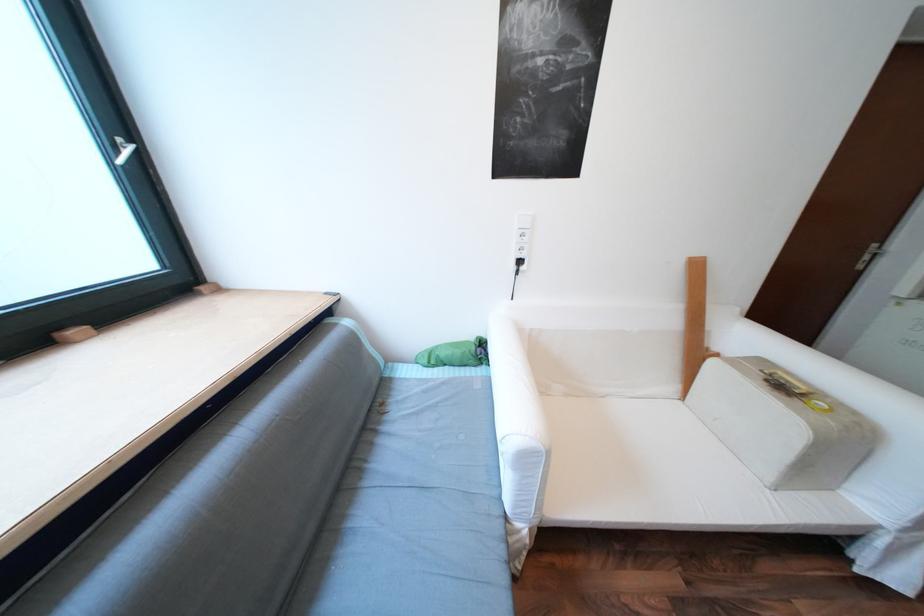
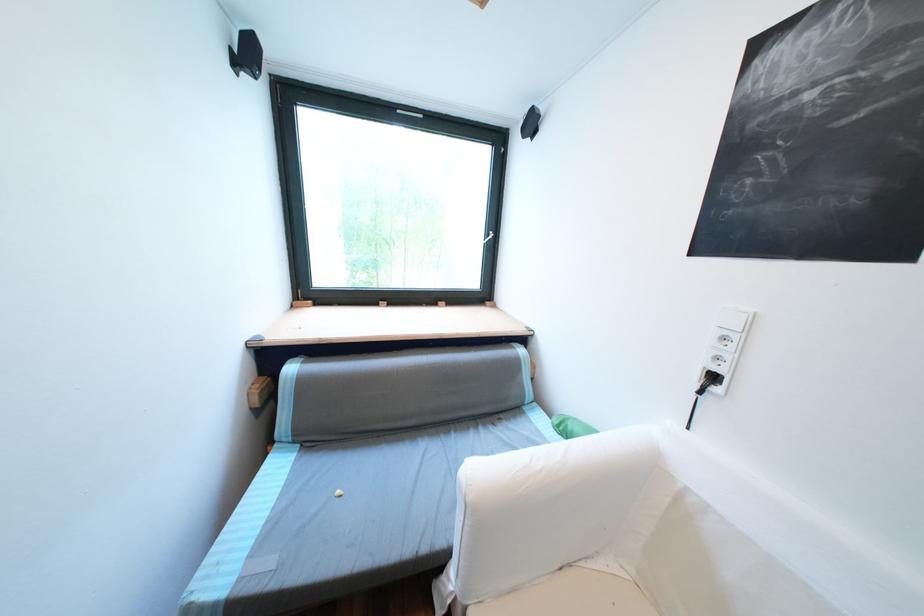
The point at (531, 268) is marked in the first image. Where is the corresponding point in the second image?

(725, 390)